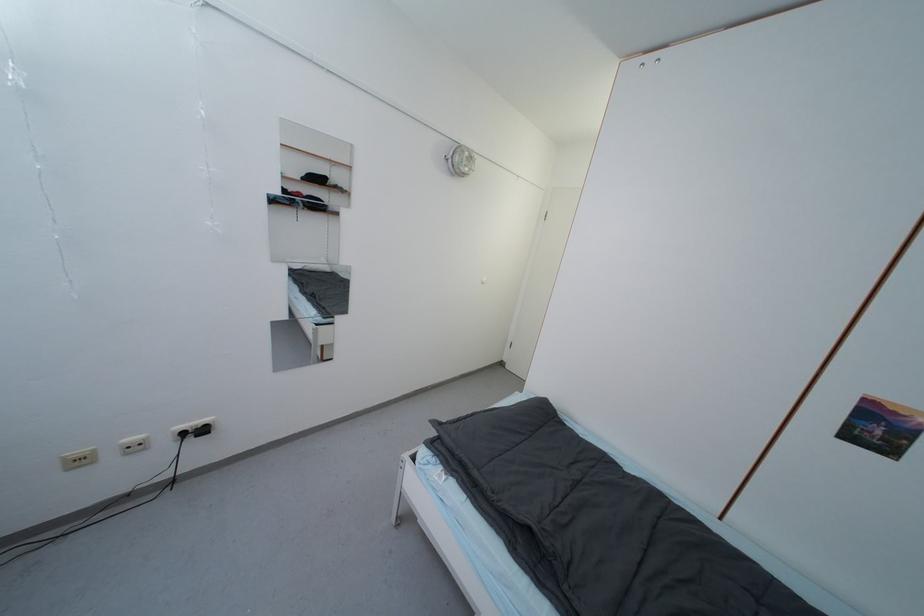
Find the location of a particular element. This screenshot has width=924, height=616. grey sleeping bag is located at coordinates (578, 503).